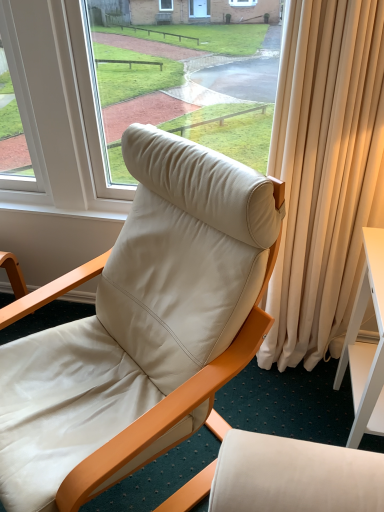
Measure the distance between matte white leather chair at center and camera.

matte white leather chair at center is 92.23 centimeters from camera.

The image size is (384, 512). I want to click on matte white leather chair at center, so click(138, 313).

Image resolution: width=384 pixels, height=512 pixels. What do you see at coordinates (138, 313) in the screenshot? I see `matte white leather chair at center` at bounding box center [138, 313].

Measure the distance between point (x=358, y=306) and camera.

They are 1.41 meters apart.

I want to click on white glossy desk at right, so tap(366, 345).

Describe the element at coordinates (366, 345) in the screenshot. The image size is (384, 512). I see `white glossy desk at right` at that location.

The width and height of the screenshot is (384, 512). What are the coordinates of `matte white leather chair at center` in the screenshot? It's located at (138, 313).

Which is more to the left, white glossy desk at right or matte white leather chair at center?

From the viewer's perspective, matte white leather chair at center appears more on the left side.

Considering the positions of objects white glossy desk at right and matte white leather chair at center in the image provided, who is in front, white glossy desk at right or matte white leather chair at center?

matte white leather chair at center.

Considering the positions of point (375, 311) and point (56, 460), is point (375, 311) closer or farther from the camera than point (56, 460)?

Clearly, point (375, 311) is more distant from the camera than point (56, 460).

From the image's perspective, is white glossy desk at right located above or below matte white leather chair at center?

From the image's perspective, white glossy desk at right appears below matte white leather chair at center.

From a real-world perspective, is white glossy desk at right above or below matte white leather chair at center?

From a real-world perspective, white glossy desk at right is physically below matte white leather chair at center.

From the picture: Can you confirm if white glossy desk at right is wider than matte white leather chair at center?

No, white glossy desk at right is not wider than matte white leather chair at center.

Considering the relative sizes of white glossy desk at right and matte white leather chair at center in the image provided, is white glossy desk at right taller than matte white leather chair at center?

In fact, white glossy desk at right may be shorter than matte white leather chair at center.

Who is smaller, white glossy desk at right or matte white leather chair at center?

white glossy desk at right is smaller.

Is matte white leather chair at center completely or partially inside white glossy desk at right?

No, matte white leather chair at center is not a part of white glossy desk at right.

Is white glossy desk at right next to matte white leather chair at center?

No, white glossy desk at right is not next to matte white leather chair at center.

Is matte white leather chair at center at the back of white glossy desk at right?

No, white glossy desk at right is not facing the opposite direction of matte white leather chair at center.

The height and width of the screenshot is (512, 384). In order to click on chair that appears on the left of white glossy desk at right in this screenshot , I will do `click(138, 313)`.

Visually, is matte white leather chair at center positioned to the left or to the right of white glossy desk at right?

From the image, it's evident that matte white leather chair at center is to the left of white glossy desk at right.

Relative to white glossy desk at right, is matte white leather chair at center in front or behind?

Clearly, matte white leather chair at center is in front of white glossy desk at right.

Which is behind, point (36, 355) or point (379, 355)?

The point (36, 355) is farther from the camera.

Looking at this image, from the image's perspective, is matte white leather chair at center below white glossy desk at right?

No, from the image's perspective, matte white leather chair at center is not below white glossy desk at right.

From a real-world perspective, is matte white leather chair at center physically located above or below white glossy desk at right?

From a real-world perspective, matte white leather chair at center is physically above white glossy desk at right.

Considering the relative sizes of matte white leather chair at center and white glossy desk at right in the image provided, is matte white leather chair at center thinner than white glossy desk at right?

In fact, matte white leather chair at center might be wider than white glossy desk at right.

Is matte white leather chair at center taller than white glossy desk at right?

Indeed, matte white leather chair at center has a greater height compared to white glossy desk at right.

Looking at this image, between matte white leather chair at center and white glossy desk at right, which one has larger size?

With larger size is matte white leather chair at center.

Is white glossy desk at right inside matte white leather chair at center?

No, white glossy desk at right is located outside of matte white leather chair at center.

Are matte white leather chair at center and white glossy desk at right far apart?

No.

Is matte white leather chair at center oriented away from white glossy desk at right?

No.

How many degrees apart are the facing directions of matte white leather chair at center and white glossy desk at right?

→ They differ by 47.5 degrees in their facing directions.

Where is `chair that appears above the white glossy desk at right (from the image's perspective)`? The width and height of the screenshot is (384, 512). chair that appears above the white glossy desk at right (from the image's perspective) is located at coordinates point(138,313).

Find the location of `desk that appears below the matte white leather chair at center (from the image's perspective)`. desk that appears below the matte white leather chair at center (from the image's perspective) is located at coordinates (366, 345).

Locate an element on the screen. chair on the left of white glossy desk at right is located at coordinates (138, 313).